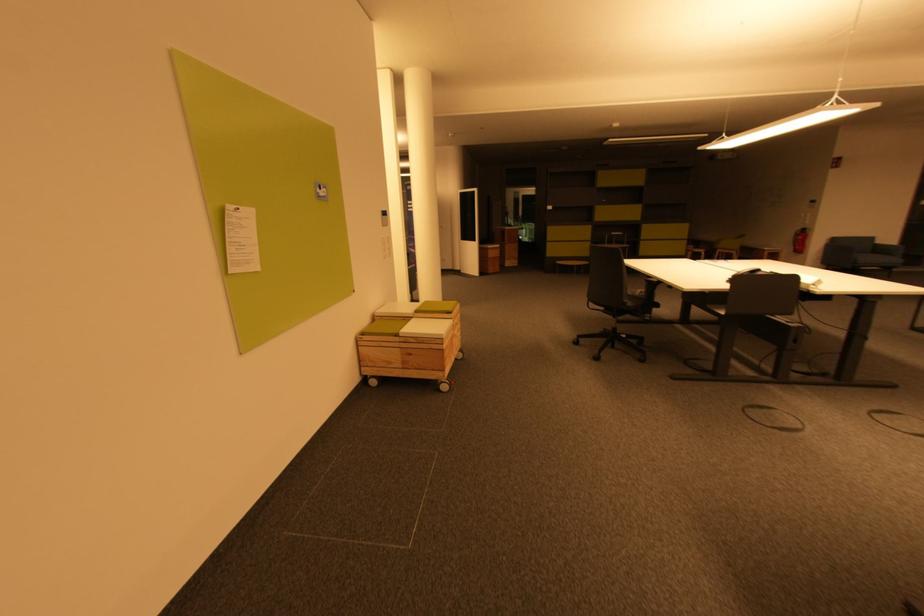
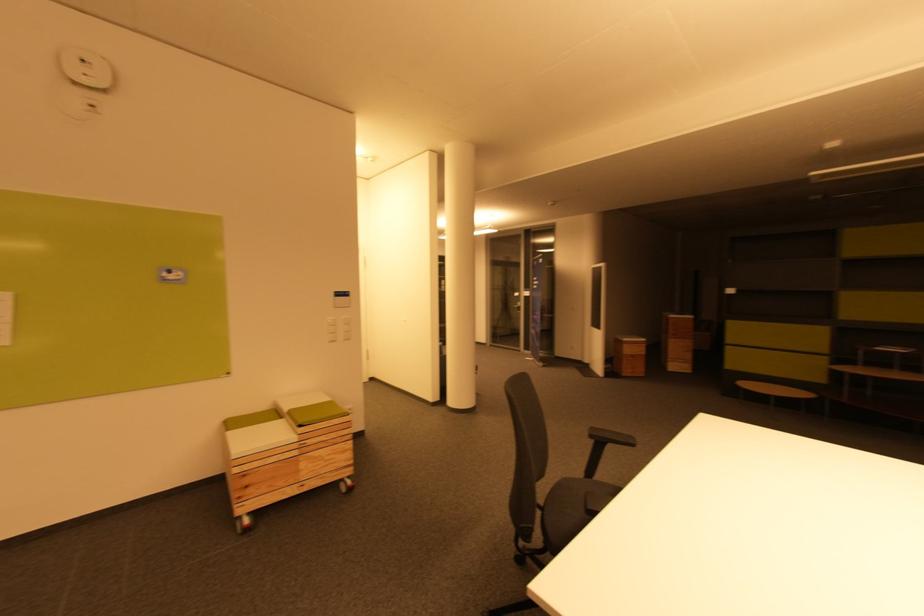
Locate, in the second image, the point that corresponds to (386,214) in the first image.

(342, 294)